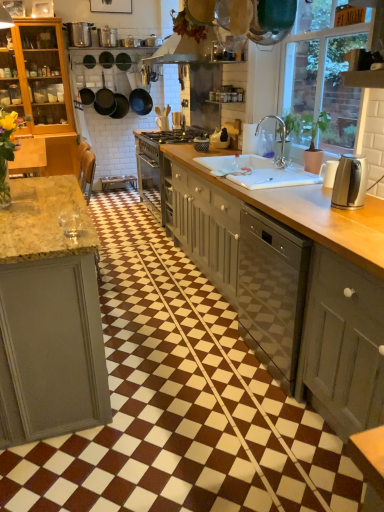
Question: Are wooden at center and gold metallic faucet at upper right located far from each other?

Choices:
 (A) yes
 (B) no

Answer: (B)

Question: Can you confirm if wooden at center is positioned to the right of gold metallic faucet at upper right?

Choices:
 (A) no
 (B) yes

Answer: (A)

Question: From a real-world perspective, is wooden at center on top of gold metallic faucet at upper right?

Choices:
 (A) no
 (B) yes

Answer: (A)

Question: Is wooden at center positioned behind gold metallic faucet at upper right?

Choices:
 (A) yes
 (B) no

Answer: (B)

Question: Considering the relative sizes of wooden at center and gold metallic faucet at upper right in the image provided, is wooden at center bigger than gold metallic faucet at upper right?

Choices:
 (A) yes
 (B) no

Answer: (A)

Question: Considering the relative positions of wooden at center and gold metallic faucet at upper right in the image provided, is wooden at center in front of gold metallic faucet at upper right?

Choices:
 (A) yes
 (B) no

Answer: (A)

Question: Considering the relative sizes of white glossy sink at center and black matte frying pan at upper left, the second frying pan viewed from the right, in the image provided, is white glossy sink at center taller than black matte frying pan at upper left, the second frying pan viewed from the right,?

Choices:
 (A) yes
 (B) no

Answer: (B)

Question: From the image's perspective, would you say white glossy sink at center is shown under black matte frying pan at upper left, the second frying pan viewed from the right?

Choices:
 (A) yes
 (B) no

Answer: (A)

Question: Is white glossy sink at center far away from black matte frying pan at upper left, the second frying pan viewed from the right?

Choices:
 (A) yes
 (B) no

Answer: (A)

Question: Is white glossy sink at center smaller than black matte frying pan at upper left, the second frying pan positioned from the left?

Choices:
 (A) yes
 (B) no

Answer: (B)

Question: Would you say white glossy sink at center is outside black matte frying pan at upper left, the second frying pan viewed from the right?

Choices:
 (A) yes
 (B) no

Answer: (A)

Question: Does white glossy sink at center come behind black matte frying pan at upper left, the second frying pan positioned from the left?

Choices:
 (A) no
 (B) yes

Answer: (A)

Question: Is matte black basket at center, which is the 4th appliance in back-to-front order, taller than satin silver toaster at center, the 4th appliance when ordered from right to left?

Choices:
 (A) no
 (B) yes

Answer: (A)